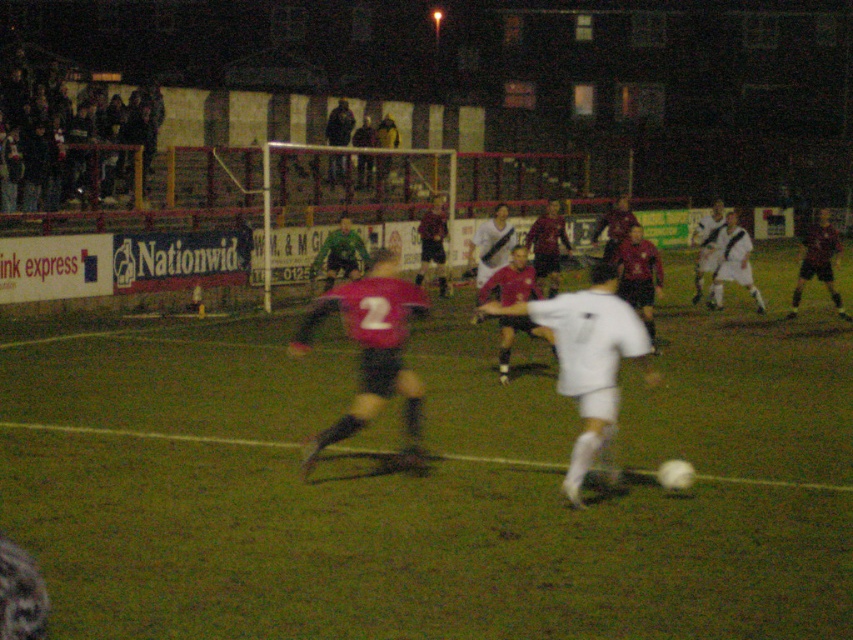
Which is behind, point (738, 522) or point (563, 488)?

Positioned behind is point (563, 488).

Does point (67, 576) come in front of point (610, 304)?

Yes, point (67, 576) is in front of point (610, 304).

Is point (105, 556) closer to viewer compared to point (573, 474)?

Yes, point (105, 556) is closer to viewer.

Find the location of a particular element. green grass football field at center is located at coordinates (433, 481).

Can you confirm if white matte soccer player at center is positioned below dark red jersey at center?

Yes, white matte soccer player at center is below dark red jersey at center.

Does white matte soccer player at center have a lesser height compared to dark red jersey at center?

Correct, white matte soccer player at center is not as tall as dark red jersey at center.

The image size is (853, 640). I want to click on white matte soccer player at center, so click(589, 362).

Where is `white matte soccer player at center`? The width and height of the screenshot is (853, 640). white matte soccer player at center is located at coordinates (589, 362).

Is white matte soccer player at center above matte red jersey at center?

No.

Is white matte soccer player at center in front of matte red jersey at center?

Yes, it is in front of matte red jersey at center.

This screenshot has height=640, width=853. Identify the location of white matte soccer player at center. (589, 362).

Locate an element on the screen. Image resolution: width=853 pixels, height=640 pixels. white matte soccer player at center is located at coordinates (589, 362).